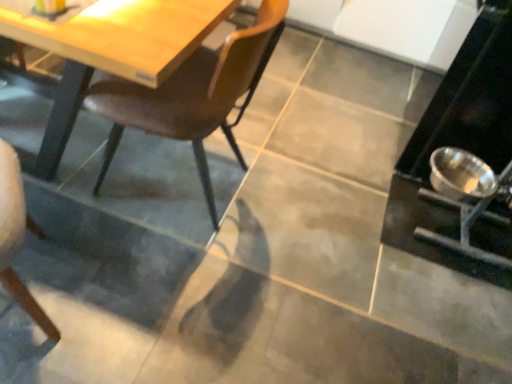
Question: From the image's perspective, is silver metallic bowl at lower right above brown leather chair at center?

Choices:
 (A) yes
 (B) no

Answer: (A)

Question: Can you confirm if silver metallic bowl at lower right is positioned to the right of brown leather chair at center?

Choices:
 (A) yes
 (B) no

Answer: (A)

Question: Can you confirm if silver metallic bowl at lower right is taller than brown leather chair at center?

Choices:
 (A) no
 (B) yes

Answer: (B)

Question: From a real-world perspective, is silver metallic bowl at lower right on brown leather chair at center?

Choices:
 (A) no
 (B) yes

Answer: (B)

Question: Can you confirm if silver metallic bowl at lower right is smaller than brown leather chair at center?

Choices:
 (A) no
 (B) yes

Answer: (A)

Question: Is the surface of silver metallic bowl at lower right in direct contact with brown leather chair at center?

Choices:
 (A) no
 (B) yes

Answer: (A)

Question: Is brown leather chair at center further to camera compared to silver metallic bowl at lower right?

Choices:
 (A) no
 (B) yes

Answer: (A)

Question: Is brown leather chair at center positioned with its back to silver metallic bowl at lower right?

Choices:
 (A) no
 (B) yes

Answer: (A)

Question: Is brown leather chair at center not within silver metallic bowl at lower right?

Choices:
 (A) no
 (B) yes

Answer: (B)

Question: Considering the relative sizes of brown leather chair at center and silver metallic bowl at lower right in the image provided, is brown leather chair at center bigger than silver metallic bowl at lower right?

Choices:
 (A) yes
 (B) no

Answer: (B)

Question: Is brown leather chair at center smaller than silver metallic bowl at lower right?

Choices:
 (A) no
 (B) yes

Answer: (B)

Question: Is brown leather chair at center wider than silver metallic bowl at lower right?

Choices:
 (A) yes
 (B) no

Answer: (B)

Question: Is silver metallic bowl at lower right bigger or smaller than brown leather chair at center?

Choices:
 (A) big
 (B) small

Answer: (A)